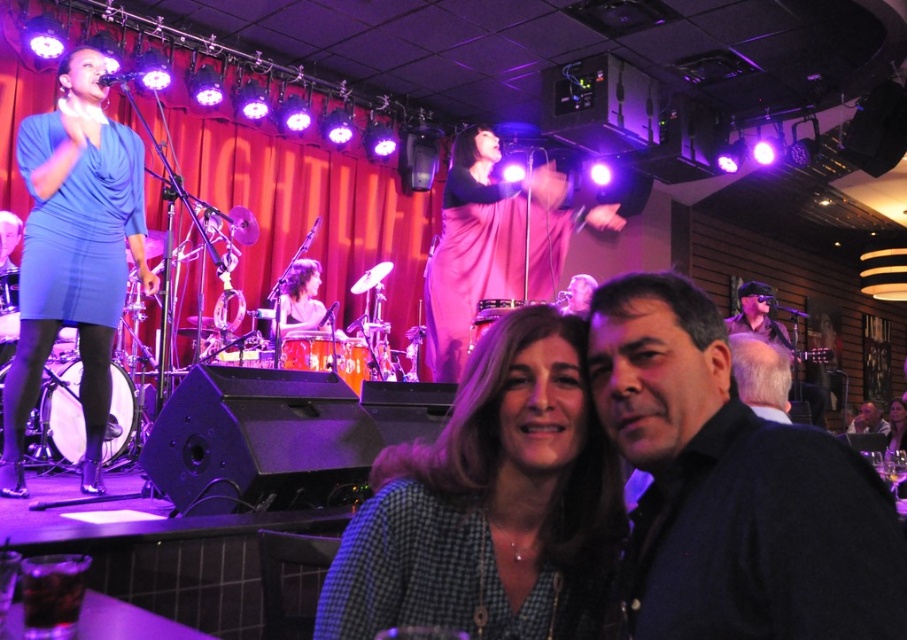
You are standing in the live music venue and want to take a photo of the point at coordinate point (781, 528). The camera you are using has a focal length of 50mm. To ensure the point is in focus, what distance should you set the focus ring to?

The point at coordinate point (781, 528) is 78.59 centimeters from the viewer, so you should set the focus ring to 78.59 centimeters to ensure it is in focus.

You are a photographer at the live music venue. You need to decide whether the checkered fabric shirt at center can be fully captured in a photo without cropping if you position your camera to focus on the metallic silver microphone at upper left. Can it fit?

The checkered fabric shirt at center might be wider than the metallic silver microphone at upper left, so there is a possibility that the shirt may not fit entirely in the frame if the camera is focused on the microphone. Adjust the camera angle or position to ensure both are visible.

You are a photographer at the venue and need to decide which outfit takes up more horizontal space. Which of the two outfits, the dark blue sweater at center or the matte blue dress at left, is wider?

The dark blue sweater at center is less wide than the matte blue dress at left, so the matte blue dress at left takes up more horizontal space.